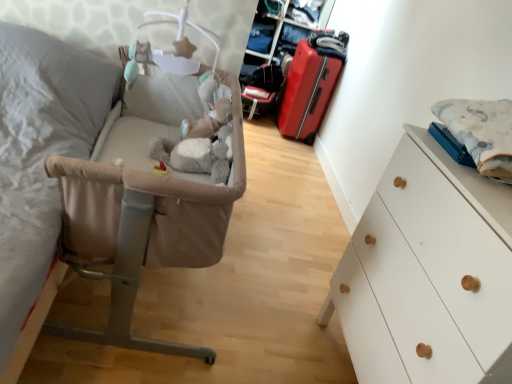
What do you see at coordinates (145, 203) in the screenshot?
I see `beige fabric infant bed at left` at bounding box center [145, 203].

What is the approximate width of fluffy white blanket at right?

It is 23.04 centimeters.

Based on the photo, measure the distance between point (454, 131) and camera.

Point (454, 131) and camera are 1.25 meters apart from each other.

Find the location of a particular element. The image size is (512, 384). beige fabric infant bed at left is located at coordinates (x=145, y=203).

Which is in front, fluffy white blanket at right or white matte chest of drawers at right?

white matte chest of drawers at right is in front.

Who is shorter, fluffy white blanket at right or white matte chest of drawers at right?

fluffy white blanket at right is shorter.

Is fluffy white blanket at right wider or thinner than white matte chest of drawers at right?

Clearly, fluffy white blanket at right has less width compared to white matte chest of drawers at right.

Which object is positioned more to the right, beige fabric infant bed at left or matte red suitcase at center-right?

Positioned to the right is matte red suitcase at center-right.

From the picture: Does beige fabric infant bed at left turn towards matte red suitcase at center-right?

No, beige fabric infant bed at left is not turned towards matte red suitcase at center-right.

Do you think beige fabric infant bed at left is within matte red suitcase at center-right, or outside of it?

beige fabric infant bed at left is outside matte red suitcase at center-right.

From the image's perspective, is beige fabric infant bed at left located beneath matte red suitcase at center-right?

Correct, beige fabric infant bed at left appears lower than matte red suitcase at center-right in the image.

Is fluffy white blanket at right closer to camera compared to beige fabric infant bed at left?

No, the depth of fluffy white blanket at right is greater than that of beige fabric infant bed at left.

The image size is (512, 384). What are the coordinates of `infant bed that is in front of the fluffy white blanket at right` in the screenshot? It's located at (145, 203).

Considering the relative positions of fluffy white blanket at right and beige fabric infant bed at left in the image provided, is fluffy white blanket at right to the right of beige fabric infant bed at left from the viewer's perspective?

Yes, fluffy white blanket at right is to the right of beige fabric infant bed at left.

Is fluffy white blanket at right shorter than matte red suitcase at center-right?

Indeed, fluffy white blanket at right has a lesser height compared to matte red suitcase at center-right.

Considering their positions, is fluffy white blanket at right located in front of or behind matte red suitcase at center-right?

Visually, fluffy white blanket at right is located in front of matte red suitcase at center-right.

From the picture: From a real-world perspective, which is physically below, fluffy white blanket at right or matte red suitcase at center-right?

matte red suitcase at center-right is physically lower.

Are matte red suitcase at center-right and fluffy white blanket at right beside each other?

No, matte red suitcase at center-right is not beside fluffy white blanket at right.

From the image's perspective, is matte red suitcase at center-right beneath fluffy white blanket at right?

Incorrect, from the image's perspective, matte red suitcase at center-right is higher than fluffy white blanket at right.

Is matte red suitcase at center-right in front of or behind fluffy white blanket at right in the image?

matte red suitcase at center-right is behind fluffy white blanket at right.

Is matte red suitcase at center-right positioned beyond the bounds of fluffy white blanket at right?

matte red suitcase at center-right lies outside fluffy white blanket at right's area.

Between point (450, 368) and point (295, 83), which one is positioned behind?

The point (295, 83) is farther.

Does white matte chest of drawers at right turn towards matte red suitcase at center-right?

No, white matte chest of drawers at right is not aimed at matte red suitcase at center-right.

This screenshot has width=512, height=384. What are the coordinates of `chest of drawers in front of the matte red suitcase at center-right` in the screenshot? It's located at (x=428, y=273).

Is white matte chest of drawers at right not near matte red suitcase at center-right?

That's right, there is a large distance between white matte chest of drawers at right and matte red suitcase at center-right.

Considering the sizes of beige fabric infant bed at left and fluffy white blanket at right in the image, is beige fabric infant bed at left taller or shorter than fluffy white blanket at right?

beige fabric infant bed at left is taller than fluffy white blanket at right.

Are beige fabric infant bed at left and fluffy white blanket at right beside each other?

No, beige fabric infant bed at left is not with fluffy white blanket at right.

Which of these two, beige fabric infant bed at left or fluffy white blanket at right, is wider?

beige fabric infant bed at left.

You are a GUI agent. You are given a task and a screenshot of the screen. Output one action in this format:
    pyautogui.click(x=<x>, y=<y>)
    Task: Click on the chest of drawers in front of the fluffy white blanket at right
    This screenshot has width=512, height=384.
    Given the screenshot: What is the action you would take?
    pyautogui.click(x=428, y=273)

I want to click on luggage located behind the beige fabric infant bed at left, so click(311, 82).

In the scene shown: Looking at the image, which one is located closer to matte red suitcase at center-right, white matte chest of drawers at right or beige fabric infant bed at left?

Among the two, beige fabric infant bed at left is located nearer to matte red suitcase at center-right.

Based on the photo, based on their spatial positions, is beige fabric infant bed at left or matte red suitcase at center-right closer to fluffy white blanket at right?

beige fabric infant bed at left is closer to fluffy white blanket at right.

Estimate the real-world distances between objects in this image. Which object is further from white matte chest of drawers at right, matte red suitcase at center-right or fluffy white blanket at right?

Based on the image, matte red suitcase at center-right appears to be further to white matte chest of drawers at right.

Looking at the image, which one is located closer to matte red suitcase at center-right, fluffy white blanket at right or white matte chest of drawers at right?

fluffy white blanket at right is closer to matte red suitcase at center-right.

When comparing their distances from white matte chest of drawers at right, does beige fabric infant bed at left or fluffy white blanket at right seem further?

The object further to white matte chest of drawers at right is beige fabric infant bed at left.

When comparing their distances from matte red suitcase at center-right, does white matte chest of drawers at right or fluffy white blanket at right seem further?

white matte chest of drawers at right.

From the image, which object appears to be nearer to beige fabric infant bed at left, matte red suitcase at center-right or fluffy white blanket at right?

Among the two, fluffy white blanket at right is located nearer to beige fabric infant bed at left.

Considering their positions, is white matte chest of drawers at right positioned closer to fluffy white blanket at right than matte red suitcase at center-right?

Among the two, white matte chest of drawers at right is located nearer to fluffy white blanket at right.

The image size is (512, 384). I want to click on the chest of drawers located between beige fabric infant bed at left and fluffy white blanket at right in the left-right direction, so click(x=428, y=273).

In order to click on linen between white matte chest of drawers at right and matte red suitcase at center-right along the z-axis in this screenshot , I will do `click(481, 132)`.

Where is `infant bed positioned between white matte chest of drawers at right and matte red suitcase at center-right from near to far`? infant bed positioned between white matte chest of drawers at right and matte red suitcase at center-right from near to far is located at coordinates (145, 203).

Where is `linen between beige fabric infant bed at left and matte red suitcase at center-right in the front-back direction`? linen between beige fabric infant bed at left and matte red suitcase at center-right in the front-back direction is located at coordinates (481, 132).